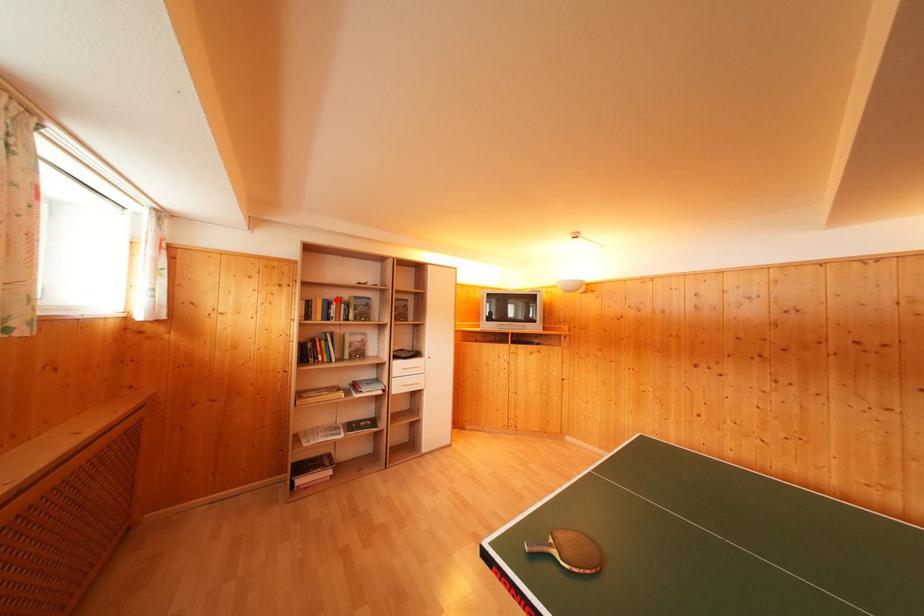
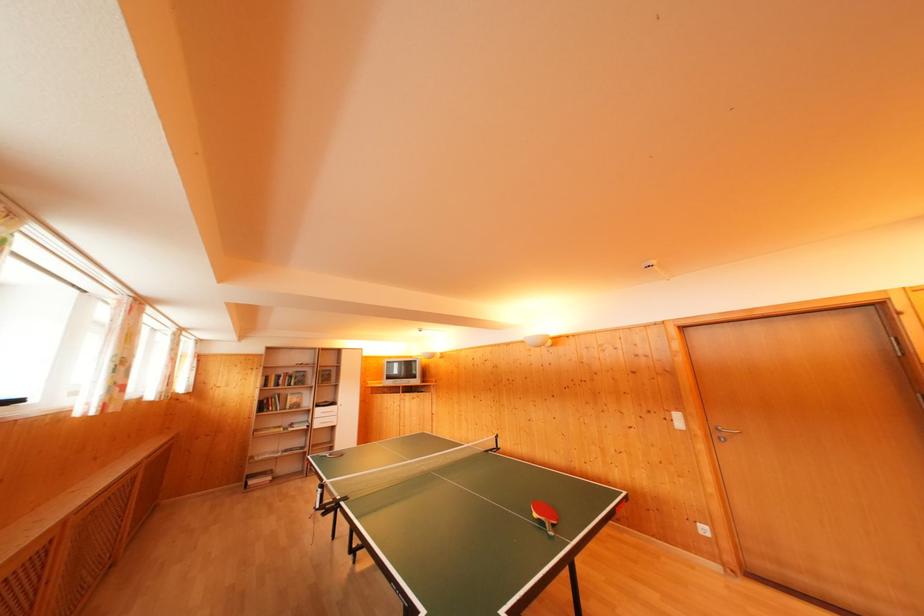
Find the pixel in the second image that matches the highlighted location in the first image.

(286, 377)